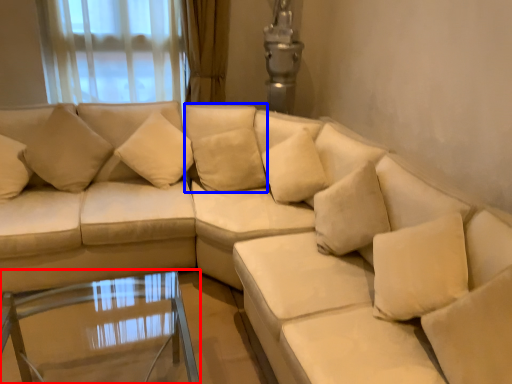
Question: Which object is further to the camera taking this photo, table (highlighted by a red box) or pillow (highlighted by a blue box)?

Choices:
 (A) table
 (B) pillow

Answer: (B)